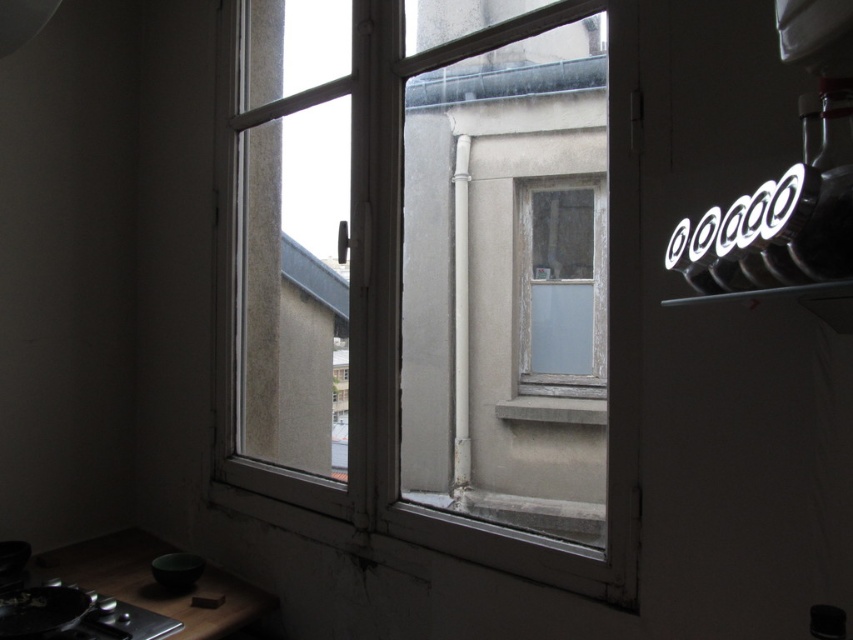
You are standing in the kitchen and want to open the white matte window at center. Based on the scene description, which direction should you move to reach it?

The white matte window at center is located at point [433,273], so you should move towards the center of the kitchen to reach it.

You are standing in the kitchen and want to look outside through the white matte window at center and also see the white glossy neon sign at upper right. Which object is closer to the left side of your view?

The white matte window at center is positioned to the left of the white glossy neon sign at upper right, so it is closer to the left side of your view.